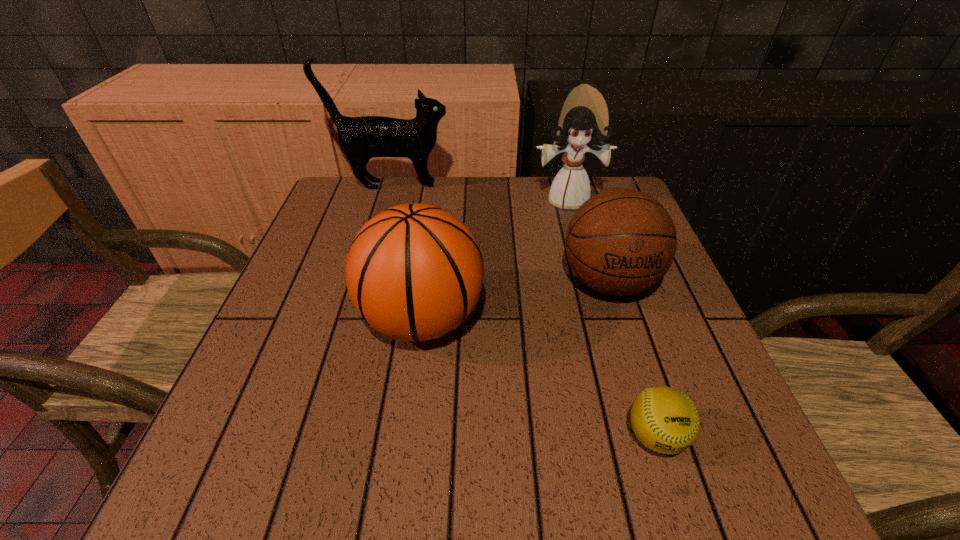
Where is `empty space between the shortest object and the right basketball`? This screenshot has height=540, width=960. empty space between the shortest object and the right basketball is located at coordinates (633, 359).

Locate an element on the screen. vacant space that's between the cat and the doll is located at coordinates (479, 193).

Find the location of `free area in between the left basketball and the doll`. free area in between the left basketball and the doll is located at coordinates (494, 260).

You are a GUI agent. You are given a task and a screenshot of the screen. Output one action in this format:
    pyautogui.click(x=<x>, y=<y>)
    Task: Click on the vacant space that is in between the left basketball and the doll
    This screenshot has width=960, height=540.
    Given the screenshot: What is the action you would take?
    pyautogui.click(x=494, y=260)

What are the coordinates of `free spot between the right basketball and the shortest object` in the screenshot? It's located at (633, 359).

You are a GUI agent. You are given a task and a screenshot of the screen. Output one action in this format:
    pyautogui.click(x=<x>, y=<y>)
    Task: Click on the free point between the fourth tallest object and the left basketball
    The width and height of the screenshot is (960, 540).
    Given the screenshot: What is the action you would take?
    pyautogui.click(x=516, y=300)

Find the location of a particular element. This screenshot has width=960, height=540. vacant space in between the left basketball and the nearest object is located at coordinates (539, 377).

The image size is (960, 540). Find the location of `empty space between the cat and the shorter basketball`. empty space between the cat and the shorter basketball is located at coordinates (500, 233).

Select which object is the third closest to the left basketball. Please provide its 2D coordinates. Your answer should be formatted as a tuple, i.e. [(x, y)], where the tuple contains the x and y coordinates of a point satisfying the conditions above.

[(584, 119)]

Point out which object is positioned as the nearest to the shortest object. Please provide its 2D coordinates. Your answer should be formatted as a tuple, i.e. [(x, y)], where the tuple contains the x and y coordinates of a point satisfying the conditions above.

[(619, 242)]